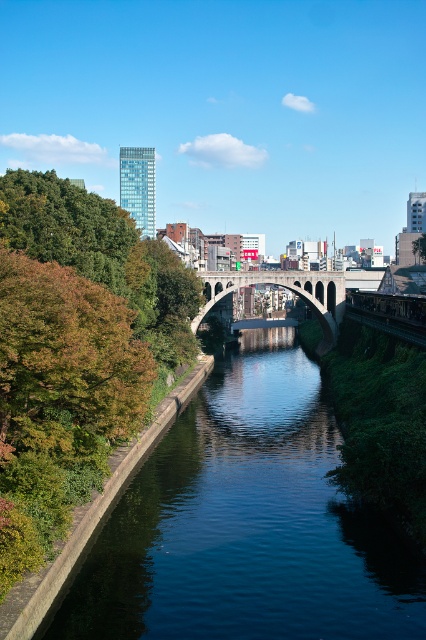
You are a city planner designing a new bike path that needs to connect the green leafy trees at left to the concrete arch bridge at center. Given that the distance between them is 47.90 meters, what is the minimum length of the bike path required to directly connect these two points?

The minimum length of the bike path required to directly connect the green leafy trees at left and the concrete arch bridge at center is 47.90 meters, as that is the distance between them.

You are standing at the camera position and want to cross the river using a small boat that can travel 60 meters. Can you reach the other side of the green concrete river at center with your boat?

The distance between you and the green concrete river at center is 58.93 meters. Since your boat can travel 60 meters, you can safely reach the other side of the green concrete river at center.

You are a city planner evaluating the space between the green concrete river at center and the concrete arch bridge at center. If the bridge is currently 20 meters wide, what is the minimum width the river must be to satisfy the condition stated in the scene description?

The green concrete river at center is wider than the concrete arch bridge at center. Since the bridge is 20 meters wide, the river must be at least 21 meters wide to satisfy the condition.